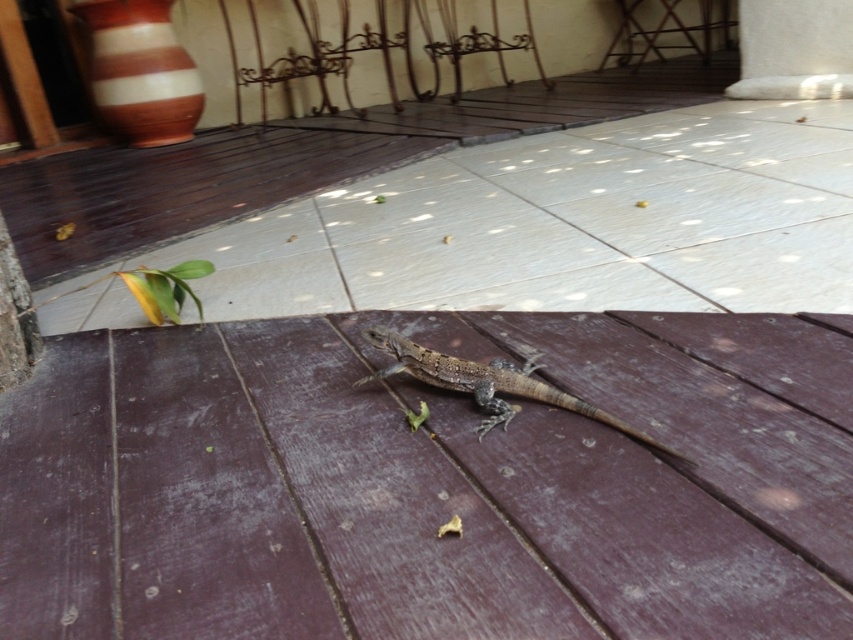
Question: Where is brown wooden deck at center located in relation to brown scaly lizard at center in the image?

Choices:
 (A) left
 (B) right

Answer: (A)

Question: Is brown wooden deck at center bigger than brown scaly lizard at center?

Choices:
 (A) yes
 (B) no

Answer: (A)

Question: Which point is farther to the camera?

Choices:
 (A) brown scaly lizard at center
 (B) brown wooden deck at center

Answer: (A)

Question: Which of the following is the closest to the observer?

Choices:
 (A) brown wooden deck at center
 (B) brown scaly lizard at center

Answer: (A)

Question: Is brown wooden deck at center further to camera compared to brown scaly lizard at center?

Choices:
 (A) yes
 (B) no

Answer: (B)